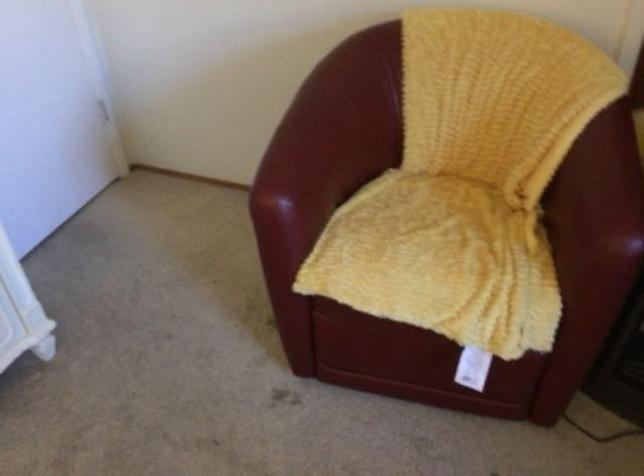
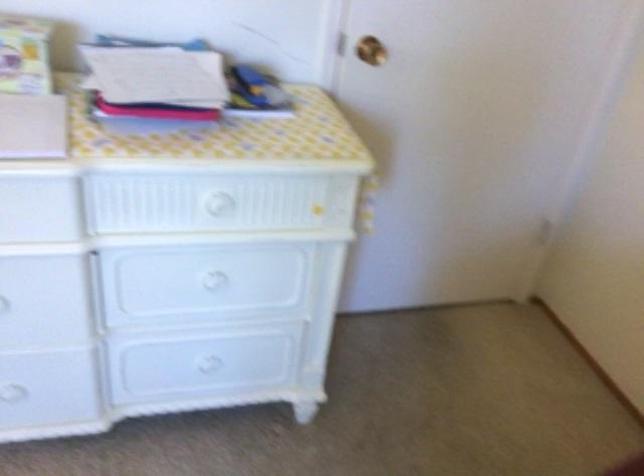
Question: The camera is either moving clockwise (left) or counter-clockwise (right) around the object. The first image is from the beginning of the video and the second image is from the end. Is the camera moving left or right when shooting the video?

Choices:
 (A) Left
 (B) Right

Answer: (B)